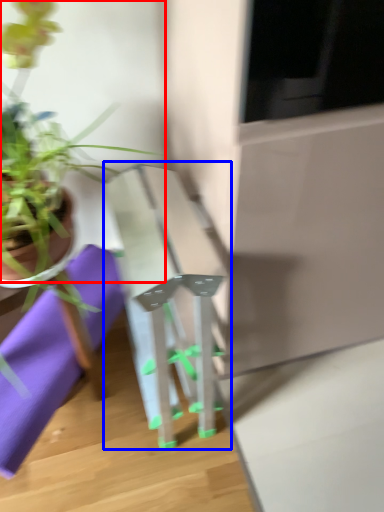
Question: Which of the following is the farthest to the observer, houseplant (highlighted by a red box) or table (highlighted by a blue box)?

Choices:
 (A) houseplant
 (B) table

Answer: (B)